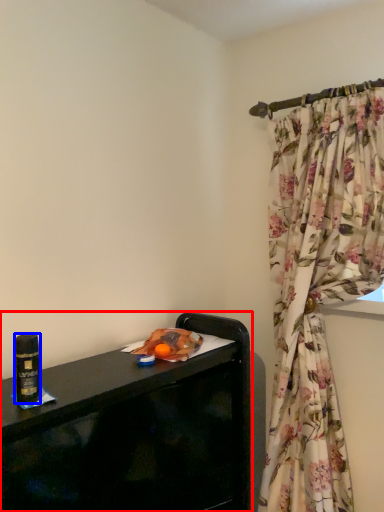
Question: Among these objects, which one is nearest to the camera, furniture (highlighted by a red box) or beverage (highlighted by a blue box)?

Choices:
 (A) furniture
 (B) beverage

Answer: (B)